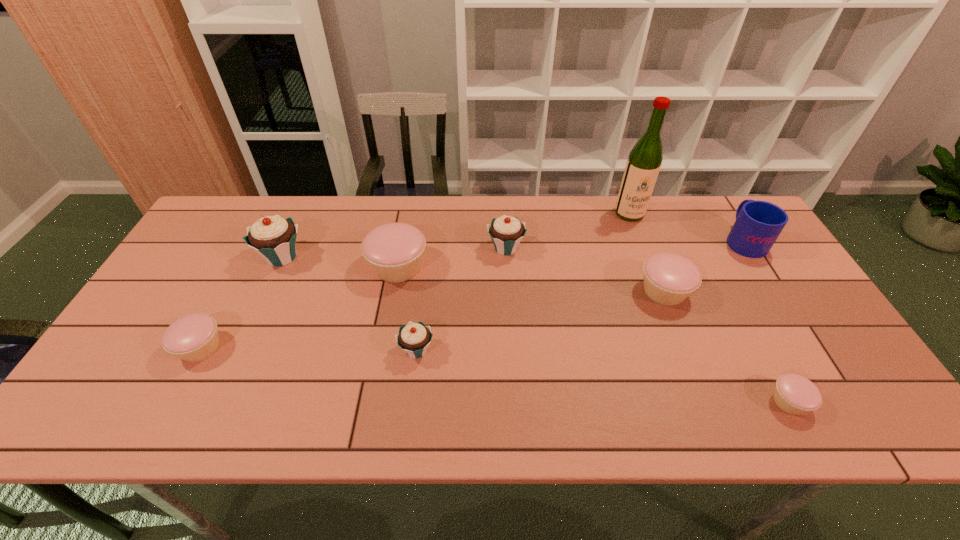
Locate an element on the screen. Image resolution: width=960 pixels, height=540 pixels. free space located on the front of the second smallest teal cupcake is located at coordinates (x=511, y=327).

Where is `free spot located 0.280m on the right of the second pink cupcake from left to right`? The height and width of the screenshot is (540, 960). free spot located 0.280m on the right of the second pink cupcake from left to right is located at coordinates (525, 267).

Locate an element on the screen. This screenshot has width=960, height=540. vacant space located on the right of the third smallest pink cupcake is located at coordinates (797, 291).

This screenshot has width=960, height=540. I want to click on vacant space situated 0.080m on the back of the nearest teal cupcake, so click(x=421, y=312).

Locate an element on the screen. This screenshot has width=960, height=540. vacant space positioned on the right of the second nearest pink cupcake is located at coordinates point(294,348).

At what (x,y) coordinates should I click in order to perform the action: click on vacant space located on the left of the nearest pink cupcake. Please return your answer as a coordinate pair (x, y). Looking at the image, I should click on (589, 402).

Where is `liquor that is at the far edge`? liquor that is at the far edge is located at coordinates (643, 165).

Where is `mug situated at the far edge`? This screenshot has height=540, width=960. mug situated at the far edge is located at coordinates (758, 224).

Locate an element on the screen. Image resolution: width=960 pixels, height=540 pixels. object that is at the near edge is located at coordinates (x=794, y=394).

Where is `object at the left edge`? object at the left edge is located at coordinates (194, 337).